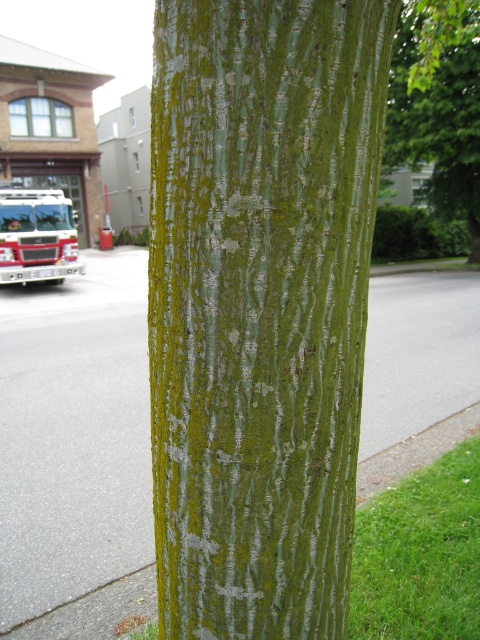
Is the position of green rough bark at center more distant than that of gray asphalt pavement at center?

No, it is in front of gray asphalt pavement at center.

Between green rough bark at center and gray asphalt pavement at center, which one is positioned lower?

green rough bark at center is below.

The width and height of the screenshot is (480, 640). In order to click on green rough bark at center in this screenshot , I will do `click(260, 305)`.

What do you see at coordinates (260, 305) in the screenshot?
I see `green rough bark at center` at bounding box center [260, 305].

Does green rough bark at center have a greater width compared to green rough bark at upper right?

In fact, green rough bark at center might be narrower than green rough bark at upper right.

Does point (365, 58) come behind point (470, 147)?

No.

The height and width of the screenshot is (640, 480). Find the location of `green rough bark at center`. green rough bark at center is located at coordinates (260, 305).

Does green rough bark at upper right have a lesser width compared to white glossy fire truck at left?

In fact, green rough bark at upper right might be wider than white glossy fire truck at left.

Does green rough bark at upper right have a greater width compared to white glossy fire truck at left?

Yes.

Measure the distance between green rough bark at upper right and camera.

green rough bark at upper right and camera are 3.43 feet apart from each other.

Locate an element on the screen. green rough bark at upper right is located at coordinates (439, 104).